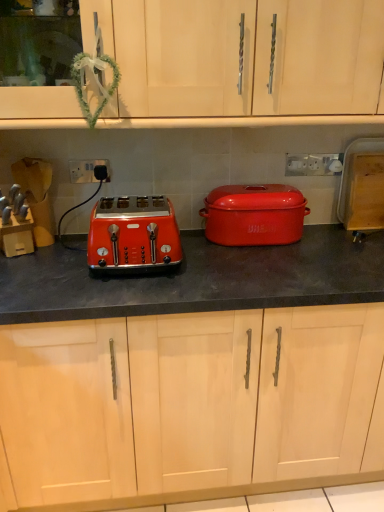
What is the approximate height of matte black toaster at left, arranged as the first cabinetry when ordered from the bottom?

It is 91.99 centimeters.

Where is `matte black toaster at left, arranged as the first cabinetry when ordered from the bottom`? The image size is (384, 512). matte black toaster at left, arranged as the first cabinetry when ordered from the bottom is located at coordinates (187, 401).

In the image, is matte wood cabinet at upper center, the second cabinetry positioned from the bottom, positioned in front of or behind matte red casserole at center?

Visually, matte wood cabinet at upper center, the second cabinetry positioned from the bottom, is located in front of matte red casserole at center.

From the image's perspective, who appears lower, matte wood cabinet at upper center, the 1th cabinetry in the top-to-bottom sequence, or matte red casserole at center?

matte red casserole at center, from the image's perspective.

Is point (31, 106) closer or farther from the camera than point (310, 159)?

Point (31, 106) is positioned closer to the camera compared to point (310, 159).

Is matte wood cabinet at upper center, the 1th cabinetry in the top-to-bottom sequence, taller than white plastic electric outlet at upper center, which is counted as the 2th electric outlet, starting from the left?

Yes.

Are matte wood cabinet at upper center, the second cabinetry positioned from the bottom, and white plastic electric outlet at upper center, acting as the 1th electric outlet starting from the back, far apart?

They are positioned close to each other.

Is white plastic socket at center, placed as the second electric outlet when sorted from back to front, turned away from matte red casserole at center?

That's not correct — white plastic socket at center, placed as the second electric outlet when sorted from back to front, is not looking away from matte red casserole at center.

Is white plastic socket at center, which is the first electric outlet in left-to-right order, to the left or to the right of matte red casserole at center in the image?

From the image, it's evident that white plastic socket at center, which is the first electric outlet in left-to-right order, is to the left of matte red casserole at center.

Is white plastic socket at center, placed as the first electric outlet when sorted from front to back, positioned far away from matte red casserole at center?

That's not correct — white plastic socket at center, placed as the first electric outlet when sorted from front to back, is a little close to matte red casserole at center.

How different are the orientations of white plastic socket at center, which is the first electric outlet in left-to-right order, and matte red casserole at center in degrees?

white plastic socket at center, which is the first electric outlet in left-to-right order, and matte red casserole at center are facing 1.37 degrees away from each other.

Which is less distant, (93, 244) or (94, 163)?

Point (93, 244) appears to be closer to the viewer than point (94, 163).

From the image's perspective, which one is positioned higher, matte orange toaster at left or white plastic socket at center, placed as the first electric outlet when sorted from front to back?

white plastic socket at center, placed as the first electric outlet when sorted from front to back, from the image's perspective.

Is matte orange toaster at left touching white plastic socket at center, placed as the first electric outlet when sorted from front to back?

No, matte orange toaster at left is not next to white plastic socket at center, placed as the first electric outlet when sorted from front to back.

Is matte orange toaster at left spatially inside white plastic socket at center, which appears as the second electric outlet when viewed from the right, or outside of it?

matte orange toaster at left cannot be found inside white plastic socket at center, which appears as the second electric outlet when viewed from the right.

From the image's perspective, is matte orange toaster at left over matte wood cabinet at upper center, the second cabinetry positioned from the bottom?

No.

Consider the image. Is matte orange toaster at left completely or partially outside of matte wood cabinet at upper center, the 1th cabinetry in the top-to-bottom sequence?

matte orange toaster at left is positioned outside matte wood cabinet at upper center, the 1th cabinetry in the top-to-bottom sequence.

This screenshot has width=384, height=512. I want to click on toaster lying below the matte wood cabinet at upper center, the 1th cabinetry in the top-to-bottom sequence (from the image's perspective), so click(x=133, y=234).

Considering the relative sizes of matte orange toaster at left and matte wood cabinet at upper center, the second cabinetry positioned from the bottom, in the image provided, is matte orange toaster at left wider than matte wood cabinet at upper center, the second cabinetry positioned from the bottom,?

Incorrect, the width of matte orange toaster at left does not surpass that of matte wood cabinet at upper center, the second cabinetry positioned from the bottom.

Can you confirm if white plastic socket at center, which is the first electric outlet in left-to-right order, is smaller than matte wood cabinet at upper center, the 1th cabinetry in the top-to-bottom sequence?

Indeed, white plastic socket at center, which is the first electric outlet in left-to-right order, has a smaller size compared to matte wood cabinet at upper center, the 1th cabinetry in the top-to-bottom sequence.

Is matte wood cabinet at upper center, the 1th cabinetry in the top-to-bottom sequence, completely or partially inside white plastic socket at center, which appears as the second electric outlet when viewed from the right?

That's incorrect, matte wood cabinet at upper center, the 1th cabinetry in the top-to-bottom sequence, is not inside white plastic socket at center, which appears as the second electric outlet when viewed from the right.

Is white plastic socket at center, which is the first electric outlet in left-to-right order, at the right side of matte wood cabinet at upper center, the second cabinetry positioned from the bottom?

No.

From the image's perspective, which one is positioned higher, matte red casserole at center or matte black toaster at left, arranged as the first cabinetry when ordered from the bottom?

From the image's view, matte red casserole at center is above.

Is matte black toaster at left, arranged as the first cabinetry when ordered from the bottom, at the back of matte red casserole at center?

No, matte black toaster at left, arranged as the first cabinetry when ordered from the bottom, is not at the back of matte red casserole at center.

From a real-world perspective, which object stands above the other?

matte red casserole at center.

Considering the positions of point (254, 223) and point (34, 424), is point (254, 223) closer or farther from the camera than point (34, 424)?

Point (254, 223) is farther from the camera than point (34, 424).

Identify the location of cabinetry that is the 2nd one when counting forward from the matte red casserole at center. This screenshot has width=384, height=512. (244, 57).

There is a matte wood cabinet at upper center, the 1th cabinetry in the top-to-bottom sequence. At what (x,y) coordinates should I click in order to perform the action: click on the 1st electric outlet below it (from a real-world perspective). Please return your answer as a coordinate pair (x, y). The width and height of the screenshot is (384, 512). Looking at the image, I should click on (313, 164).

Which object lies further to the anchor point matte black toaster at left, arranged as the first cabinetry when ordered from the bottom, matte wood cabinet at upper center, the second cabinetry positioned from the bottom, or white plastic electric outlet at upper center, acting as the 1th electric outlet starting from the back?

white plastic electric outlet at upper center, acting as the 1th electric outlet starting from the back, is positioned further to the anchor matte black toaster at left, arranged as the first cabinetry when ordered from the bottom.

Looking at the image, which one is located closer to matte orange toaster at left, matte red casserole at center or matte black toaster at left, which appears as the 2th cabinetry when viewed from the top?

Among the two, matte red casserole at center is located nearer to matte orange toaster at left.

Looking at the image, which one is located closer to white plastic electric outlet at upper center, acting as the 1th electric outlet starting from the back, matte black toaster at left, which appears as the 2th cabinetry when viewed from the top, or matte red casserole at center?

Based on the image, matte red casserole at center appears to be nearer to white plastic electric outlet at upper center, acting as the 1th electric outlet starting from the back.

Estimate the real-world distances between objects in this image. Which object is closer to white plastic electric outlet at upper center, the second electric outlet viewed from the front, matte black toaster at left, arranged as the first cabinetry when ordered from the bottom, or matte wood cabinet at upper center, the second cabinetry positioned from the bottom?

Among the two, matte wood cabinet at upper center, the second cabinetry positioned from the bottom, is located nearer to white plastic electric outlet at upper center, the second electric outlet viewed from the front.

When comparing their distances from white plastic electric outlet at upper center, the second electric outlet viewed from the front, does white plastic socket at center, placed as the second electric outlet when sorted from back to front, or matte red casserole at center seem further?

Based on the image, white plastic socket at center, placed as the second electric outlet when sorted from back to front, appears to be further to white plastic electric outlet at upper center, the second electric outlet viewed from the front.

Estimate the real-world distances between objects in this image. Which object is further from matte black toaster at left, which appears as the 2th cabinetry when viewed from the top, white plastic socket at center, which is the first electric outlet in left-to-right order, or matte red casserole at center?

white plastic socket at center, which is the first electric outlet in left-to-right order, is positioned further to the anchor matte black toaster at left, which appears as the 2th cabinetry when viewed from the top.

Considering their positions, is white plastic electric outlet at upper center, placed as the 1th electric outlet when sorted from right to left, positioned closer to matte red casserole at center than matte wood cabinet at upper center, the second cabinetry positioned from the bottom?

white plastic electric outlet at upper center, placed as the 1th electric outlet when sorted from right to left, is positioned closer to the anchor matte red casserole at center.

Looking at the image, which one is located closer to matte wood cabinet at upper center, the 1th cabinetry in the top-to-bottom sequence, white plastic socket at center, placed as the first electric outlet when sorted from front to back, or matte orange toaster at left?

Among the two, matte orange toaster at left is located nearer to matte wood cabinet at upper center, the 1th cabinetry in the top-to-bottom sequence.

Where is `toaster between white plastic socket at center, which is the first electric outlet in left-to-right order, and matte red casserole at center`? The height and width of the screenshot is (512, 384). toaster between white plastic socket at center, which is the first electric outlet in left-to-right order, and matte red casserole at center is located at coordinates (133, 234).

In order to click on toaster between white plastic socket at center, placed as the second electric outlet when sorted from back to front, and matte black toaster at left, arranged as the first cabinetry when ordered from the bottom, in the vertical direction in this screenshot , I will do `click(133, 234)`.

At what (x,y) coordinates should I click in order to perform the action: click on kitchen appliance between matte orange toaster at left and white plastic electric outlet at upper center, acting as the 1th electric outlet starting from the back. Please return your answer as a coordinate pair (x, y). Looking at the image, I should click on 254,215.

You are a GUI agent. You are given a task and a screenshot of the screen. Output one action in this format:
    pyautogui.click(x=<x>, y=<y>)
    Task: Click on the toaster between white plastic socket at center, placed as the second electric outlet when sorted from back to front, and white plastic electric outlet at upper center, acting as the 1th electric outlet starting from the back, from left to right
    The image size is (384, 512).
    Given the screenshot: What is the action you would take?
    pyautogui.click(x=133, y=234)